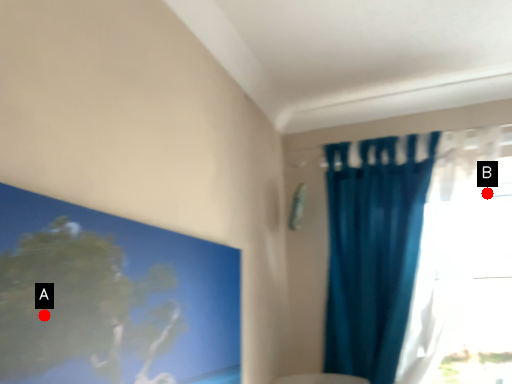
Question: Two points are circled on the image, labeled by A and B beside each circle. Which point appears farthest from the camera in this image?

Choices:
 (A) A is further
 (B) B is further

Answer: (B)